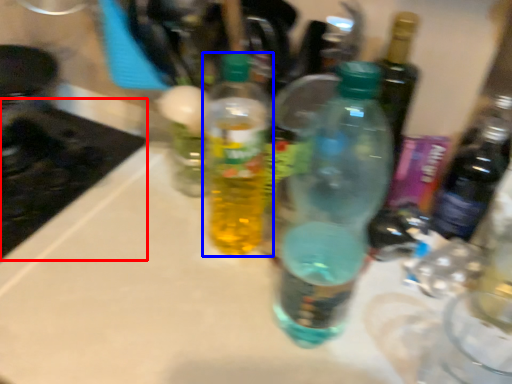
Question: Which point is further to the camera, appliance (highlighted by a red box) or bottle (highlighted by a blue box)?

Choices:
 (A) appliance
 (B) bottle

Answer: (A)